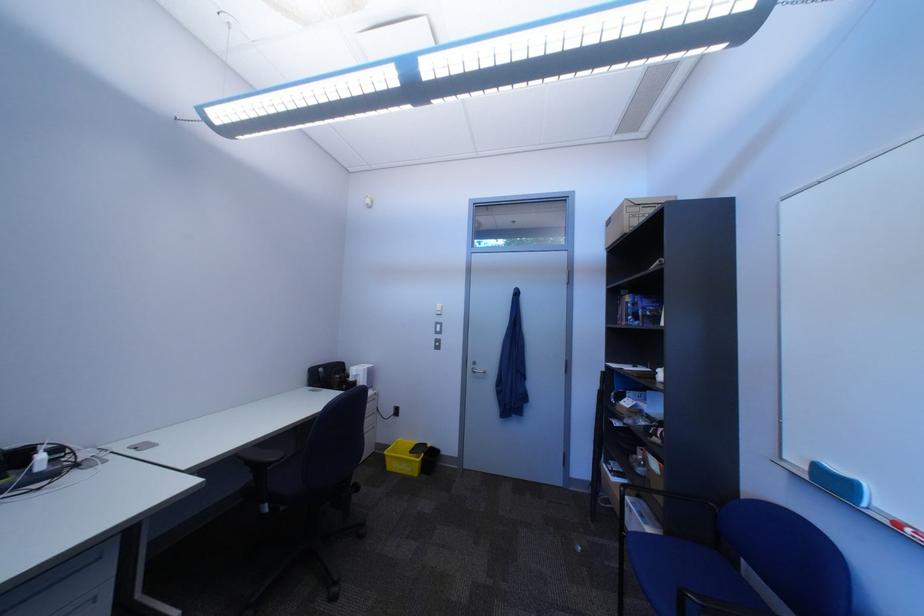
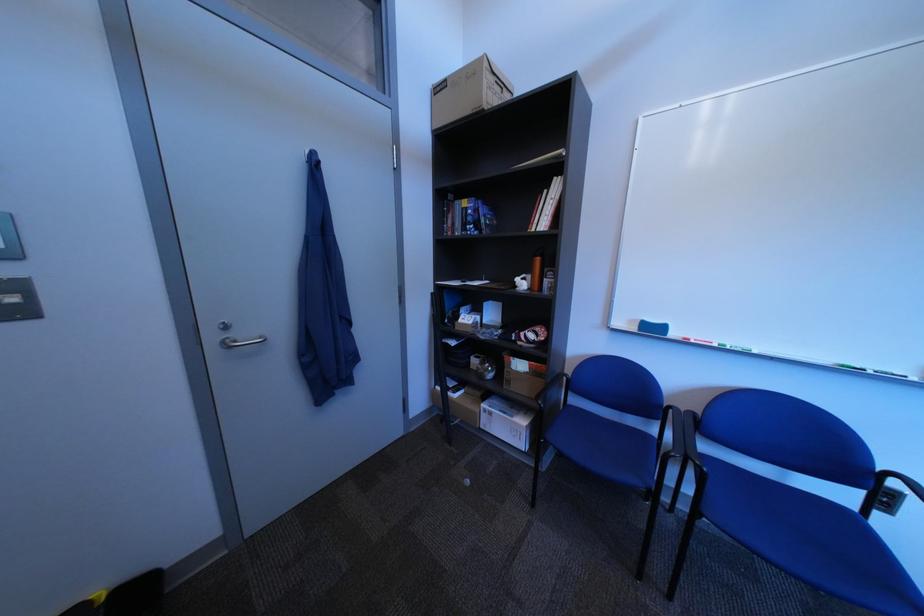
In the second image, find the point that corresponds to point (677, 370) in the first image.

(535, 278)